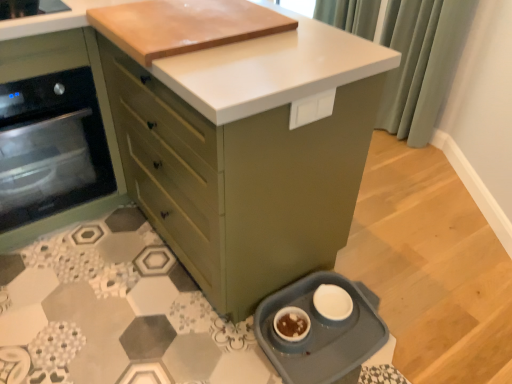
Locate an element on the screen. The width and height of the screenshot is (512, 384). vacant space situated on the left part of blue plastic pet dish at lower right is located at coordinates (203, 339).